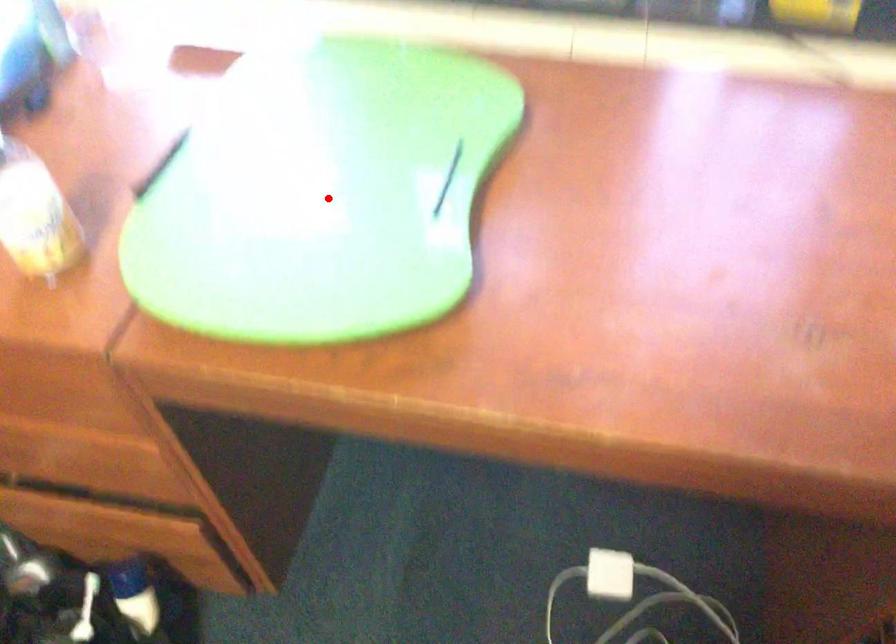
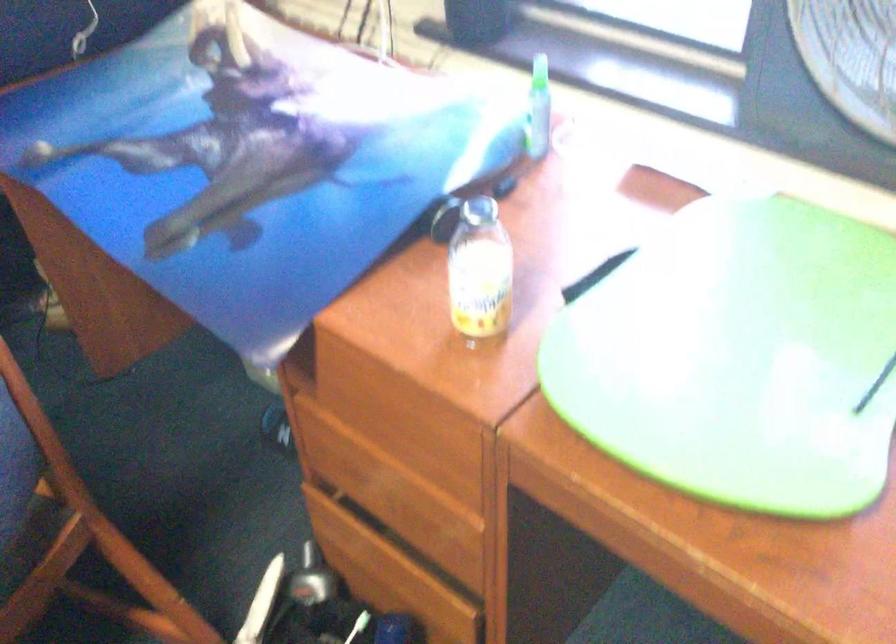
Where in the second image is the point corresponding to the highlighted location from the first image?

(738, 357)